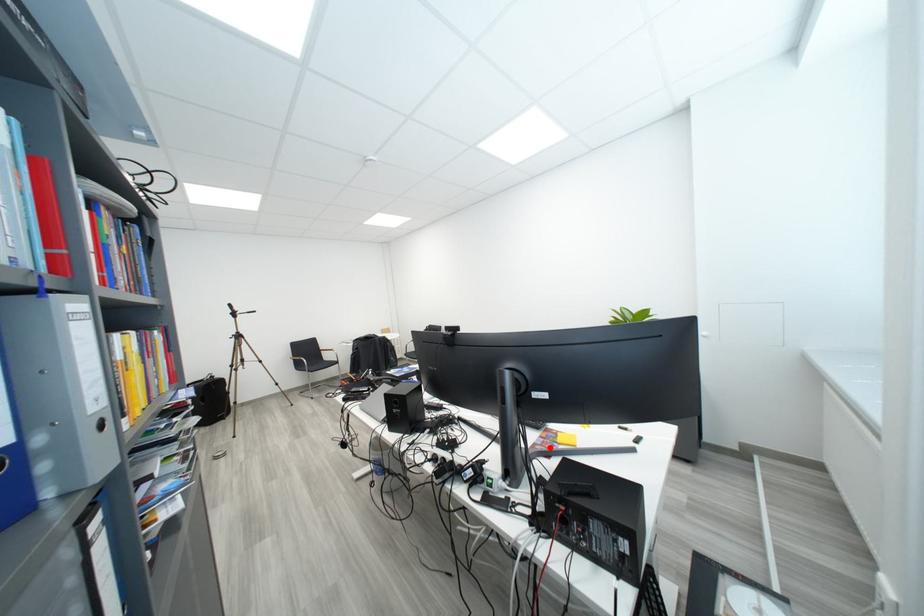
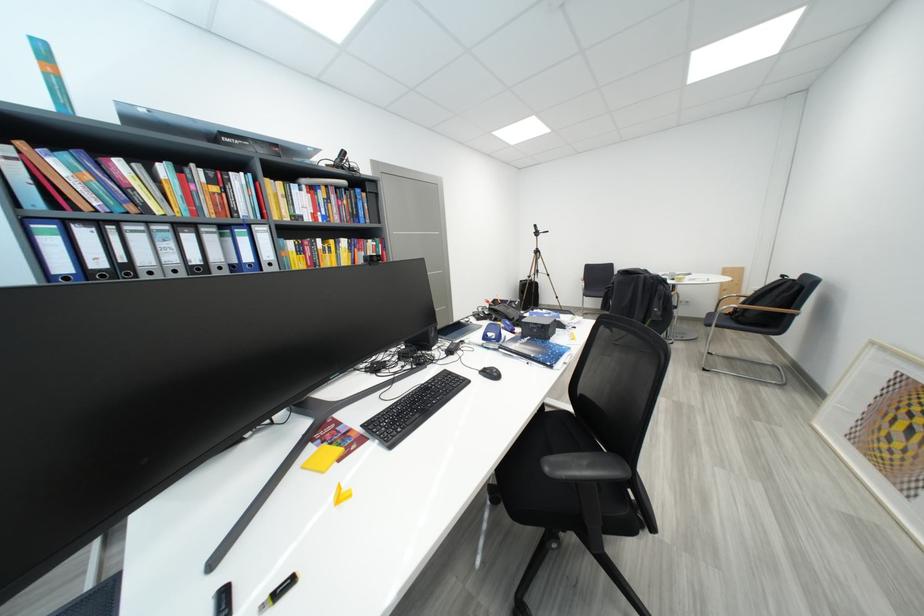
Locate, in the second image, the point that corresponds to the highlighted location in the first image.

(343, 432)